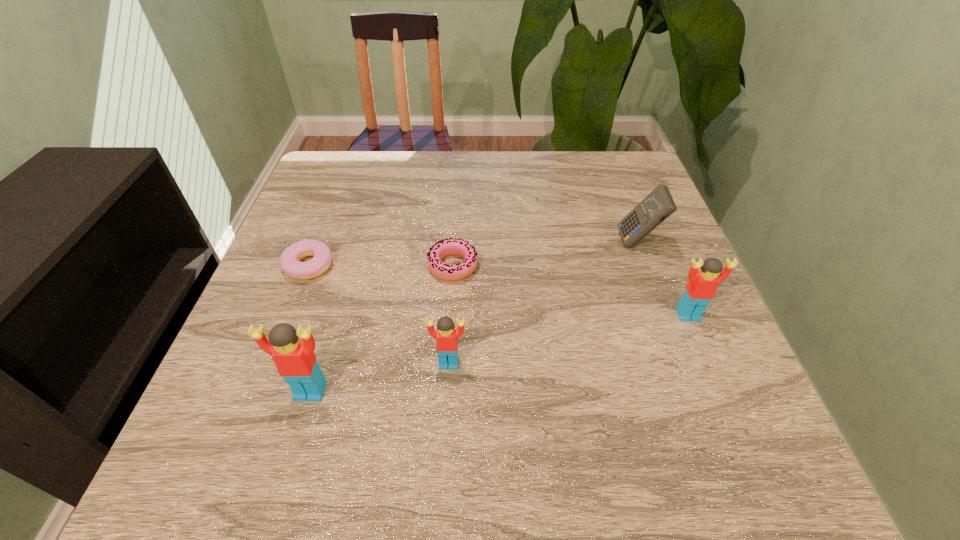
I want to click on the nearest Lego, so click(x=294, y=358).

At what (x,y) coordinates should I click in order to perform the action: click on the nearest object. Please return your answer as a coordinate pair (x, y). The width and height of the screenshot is (960, 540). Looking at the image, I should click on (294, 358).

Locate an element on the screen. This screenshot has height=540, width=960. the shortest Lego is located at coordinates (446, 336).

Where is `the fourth tallest object`? The height and width of the screenshot is (540, 960). the fourth tallest object is located at coordinates (446, 336).

Locate an element on the screen. This screenshot has width=960, height=540. the rightmost Lego is located at coordinates (701, 288).

The height and width of the screenshot is (540, 960). I want to click on the farthest Lego, so click(x=701, y=288).

The image size is (960, 540). Identify the location of the right doughnut. (452, 246).

I want to click on the left doughnut, so pos(290,263).

This screenshot has height=540, width=960. Find the location of `calculator`. calculator is located at coordinates (657, 206).

The height and width of the screenshot is (540, 960). I want to click on vacant area located on the face of the second nearest object, so click(446, 400).